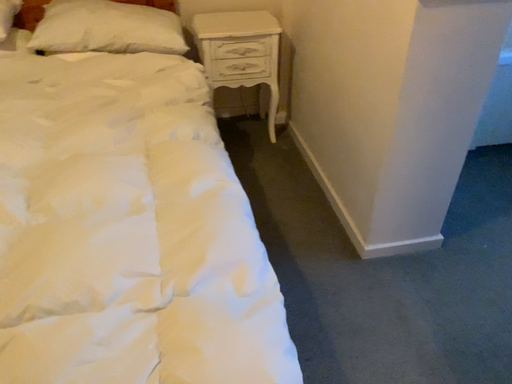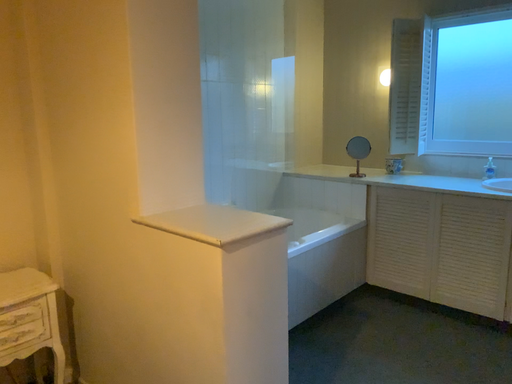
Question: How did the camera likely rotate when shooting the video?

Choices:
 (A) rotated left
 (B) rotated right

Answer: (B)